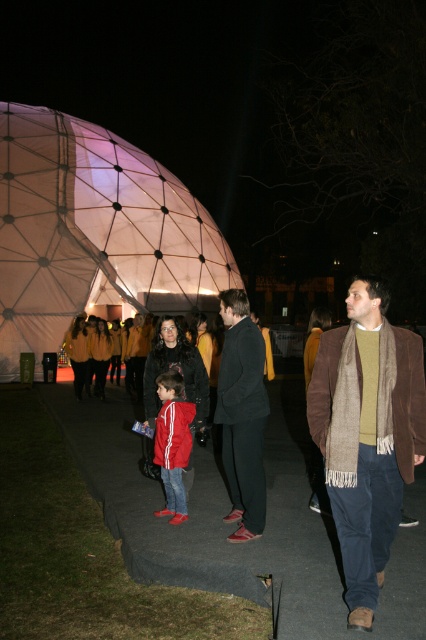
In the scene shown: Does dark gray wool coat at center appear under red matte jacket at center?

Actually, dark gray wool coat at center is above red matte jacket at center.

Does dark gray wool coat at center appear over red matte jacket at center?

Indeed, dark gray wool coat at center is positioned over red matte jacket at center.

Who is more forward, (x=229, y=410) or (x=164, y=397)?

Point (x=229, y=410) is in front.

Where is `dark gray wool coat at center`? The width and height of the screenshot is (426, 640). dark gray wool coat at center is located at coordinates 241,413.

Is brown woolen scarf at center further to camera compared to dark gray wool coat at center?

No, brown woolen scarf at center is closer to the viewer.

Based on the photo, is brown woolen scarf at center wider than dark gray wool coat at center?

Yes.

Identify the location of brown woolen scarf at center. (367, 435).

Does translucent fabric dome at center appear on the right side of dark gray wool coat at center?

Incorrect, translucent fabric dome at center is not on the right side of dark gray wool coat at center.

The width and height of the screenshot is (426, 640). What do you see at coordinates (94, 232) in the screenshot? I see `translucent fabric dome at center` at bounding box center [94, 232].

This screenshot has width=426, height=640. Describe the element at coordinates (94, 232) in the screenshot. I see `translucent fabric dome at center` at that location.

Where is `translucent fabric dome at center`? translucent fabric dome at center is located at coordinates (94, 232).